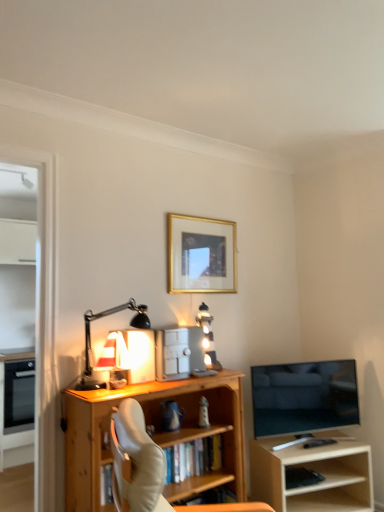
At what (x,y) coordinates should I click in order to perform the action: click on light wood shelf at right. Please return your answer as a coordinate pair (x, y). Looking at the image, I should click on (315, 471).

What do you see at coordinates (201, 255) in the screenshot? Image resolution: width=384 pixels, height=512 pixels. I see `gold-framed picture at upper center` at bounding box center [201, 255].

What do you see at coordinates (301, 477) in the screenshot? The height and width of the screenshot is (512, 384). I see `black matte keyboard at lower right` at bounding box center [301, 477].

Describe the element at coordinates (304, 397) in the screenshot. The image size is (384, 512). I see `flat screen tv at right` at that location.

In order to click on transparent glass door at left in this screenshot , I will do `click(21, 260)`.

Is wooden bookcase at center bigger or smaller than transparent glass door at left?

wooden bookcase at center is bigger than transparent glass door at left.

What's the angular difference between wooden bookcase at center and transparent glass door at left's facing directions?

There is a 0.343-degree angle between the facing directions of wooden bookcase at center and transparent glass door at left.

Looking at their sizes, would you say wooden bookcase at center is wider or thinner than transparent glass door at left?

wooden bookcase at center is wider than transparent glass door at left.

Is the depth of flat screen tv at right greater than that of matte black oven at left, which appears as the 2th appliance when viewed from the top?

No, it is in front of matte black oven at left, which appears as the 2th appliance when viewed from the top.

Between flat screen tv at right and matte black oven at left, placed as the first appliance when sorted from left to right, which one appears on the left side from the viewer's perspective?

matte black oven at left, placed as the first appliance when sorted from left to right, is more to the left.

Consider the image. Could you tell me if flat screen tv at right is turned towards matte black oven at left, which appears as the second appliance when viewed from the front?

No, flat screen tv at right does not turn towards matte black oven at left, which appears as the second appliance when viewed from the front.

From the image's perspective, relative to matte black oven at left, the 2th appliance positioned from the right, is flat screen tv at right above or below?

From the image's perspective, flat screen tv at right appears above matte black oven at left, the 2th appliance positioned from the right.

Are matte black oven at left, the 2th appliance positioned from the right, and transparent glass door at left making contact?

No, matte black oven at left, the 2th appliance positioned from the right, is not beside transparent glass door at left.

Consider the image. Which object is wider, matte black oven at left, the 2th appliance positioned from the right, or transparent glass door at left?

Wider between the two is matte black oven at left, the 2th appliance positioned from the right.

Can you tell me how much matte black oven at left, which is counted as the first appliance, starting from the bottom, and transparent glass door at left differ in facing direction?

0.553 degrees.

Is matte black oven at left, which is counted as the first appliance, starting from the bottom, completely or partially outside of transparent glass door at left?

Yes.

From a real-world perspective, between gold-framed picture at upper center and black matte desk lamp at left, who is vertically lower?

In real-world perspective, black matte desk lamp at left is lower.

Is gold-framed picture at upper center aimed at black matte desk lamp at left?

No.

Which is behind, point (214, 271) or point (96, 315)?

The point (214, 271) is farther.

Is gold-framed picture at upper center not close to black matte desk lamp at left?

gold-framed picture at upper center is actually quite close to black matte desk lamp at left.

Is matte black oven at left, the 2th appliance positioned from the right, next to metallic silver safe at center, arranged as the 2th appliance when viewed from the back, and touching it?

No, matte black oven at left, the 2th appliance positioned from the right, is not with metallic silver safe at center, arranged as the 2th appliance when viewed from the back.

Considering the sizes of objects matte black oven at left, the 2th appliance positioned from the right, and metallic silver safe at center, the 1th appliance viewed from the right, in the image provided, who is thinner, matte black oven at left, the 2th appliance positioned from the right, or metallic silver safe at center, the 1th appliance viewed from the right,?

Thinner between the two is metallic silver safe at center, the 1th appliance viewed from the right.

From a real-world perspective, relative to metallic silver safe at center, which ranks as the second appliance in left-to-right order, is matte black oven at left, placed as the first appliance when sorted from left to right, vertically above or below?

From a real-world perspective, matte black oven at left, placed as the first appliance when sorted from left to right, is physically below metallic silver safe at center, which ranks as the second appliance in left-to-right order.

Is matte black oven at left, which appears as the second appliance when viewed from the front, facing away from metallic silver safe at center, arranged as the 1th appliance when viewed from the top?

matte black oven at left, which appears as the second appliance when viewed from the front, is not turned away from metallic silver safe at center, arranged as the 1th appliance when viewed from the top.

Considering the sizes of objects wooden bookcase at center and metallic silver safe at center, the first appliance in the front-to-back sequence, in the image provided, who is bigger, wooden bookcase at center or metallic silver safe at center, the first appliance in the front-to-back sequence,?

wooden bookcase at center.

From the image's perspective, which is below, wooden bookcase at center or metallic silver safe at center, which ranks as the second appliance in left-to-right order?

wooden bookcase at center appears lower in the image.

Looking at their sizes, would you say wooden bookcase at center is wider or thinner than metallic silver safe at center, the 1th appliance viewed from the right?

In the image, wooden bookcase at center appears to be wider than metallic silver safe at center, the 1th appliance viewed from the right.

Is wooden bookcase at center oriented towards metallic silver safe at center, the 1th appliance viewed from the right?

No, wooden bookcase at center is not oriented towards metallic silver safe at center, the 1th appliance viewed from the right.

Which object is closer to the camera taking this photo, gold-framed picture at upper center or matte black oven at left, which appears as the 2th appliance when viewed from the top?

gold-framed picture at upper center.

Which is correct: gold-framed picture at upper center is inside matte black oven at left, the 2th appliance positioned from the right, or outside of it?

gold-framed picture at upper center is located beyond the bounds of matte black oven at left, the 2th appliance positioned from the right.

Is gold-framed picture at upper center not near matte black oven at left, which appears as the second appliance when viewed from the front?

Absolutely, gold-framed picture at upper center is distant from matte black oven at left, which appears as the second appliance when viewed from the front.

Where is `the 2nd appliance to the left when counting from the gold-framed picture at upper center`? The height and width of the screenshot is (512, 384). the 2nd appliance to the left when counting from the gold-framed picture at upper center is located at coordinates (19, 395).

You are a GUI agent. You are given a task and a screenshot of the screen. Output one action in this format:
    pyautogui.click(x=<x>, y=<y>)
    Task: Click on the glass door located above the wooden bookcase at center (from a real-world perspective)
    
    Given the screenshot: What is the action you would take?
    (x=21, y=260)

This screenshot has height=512, width=384. I want to click on television located above the matte black oven at left, which is counted as the first appliance, starting from the bottom (from the image's perspective), so click(304, 397).

When comparing their distances from light wood shelf at right, does flat screen tv at right or metallic silver safe at center, which is the second appliance from bottom to top, seem further?

Based on the image, metallic silver safe at center, which is the second appliance from bottom to top, appears to be further to light wood shelf at right.

When comparing their distances from light wood shelf at right, does flat screen tv at right or gold-framed picture at upper center seem further?

gold-framed picture at upper center is further to light wood shelf at right.

Looking at the image, which one is located closer to wooden bookcase at center, gold-framed picture at upper center or flat screen tv at right?

Among the two, flat screen tv at right is located nearer to wooden bookcase at center.

Based on their spatial positions, is flat screen tv at right or light wood shelf at right closer to transparent glass door at left?

The object closer to transparent glass door at left is flat screen tv at right.

Estimate the real-world distances between objects in this image. Which object is further from matte black oven at left, acting as the first appliance starting from the back, gold-framed picture at upper center or transparent glass door at left?

gold-framed picture at upper center is positioned further to the anchor matte black oven at left, acting as the first appliance starting from the back.

Considering their positions, is flat screen tv at right positioned closer to black matte keyboard at lower right than matte black oven at left, which appears as the 2th appliance when viewed from the top?

flat screen tv at right.

In the scene shown: Considering their positions, is gold-framed picture at upper center positioned closer to matte black oven at left, which appears as the 2th appliance when viewed from the top, than light wood shelf at right?

Based on the image, gold-framed picture at upper center appears to be nearer to matte black oven at left, which appears as the 2th appliance when viewed from the top.

Estimate the real-world distances between objects in this image. Which object is closer to wooden bookcase at center, matte black oven at left, acting as the first appliance starting from the back, or gold-framed picture at upper center?

gold-framed picture at upper center is closer to wooden bookcase at center.

Image resolution: width=384 pixels, height=512 pixels. I want to click on television situated between matte black oven at left, which is counted as the first appliance, starting from the bottom, and light wood shelf at right from left to right, so click(304, 397).

Identify the location of book located between wooden bookcase at center and light wood shelf at right in the left-right direction. This screenshot has height=512, width=384. (301, 477).

Locate an element on the screen. This screenshot has height=512, width=384. appliance that lies between gold-framed picture at upper center and wooden bookcase at center from top to bottom is located at coordinates (178, 352).

The height and width of the screenshot is (512, 384). Find the location of `appliance between gold-framed picture at upper center and flat screen tv at right vertically`. appliance between gold-framed picture at upper center and flat screen tv at right vertically is located at coordinates (178, 352).